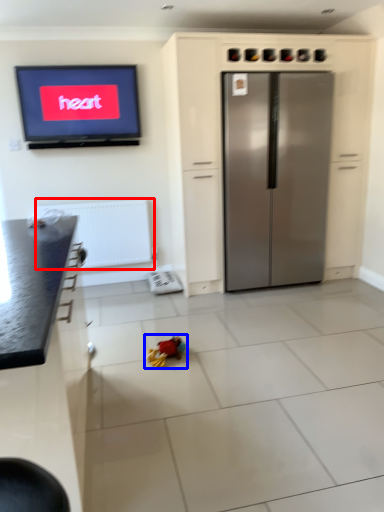
Question: Which point is closer to the camera, radiator (highlighted by a red box) or toy (highlighted by a blue box)?

Choices:
 (A) radiator
 (B) toy

Answer: (B)